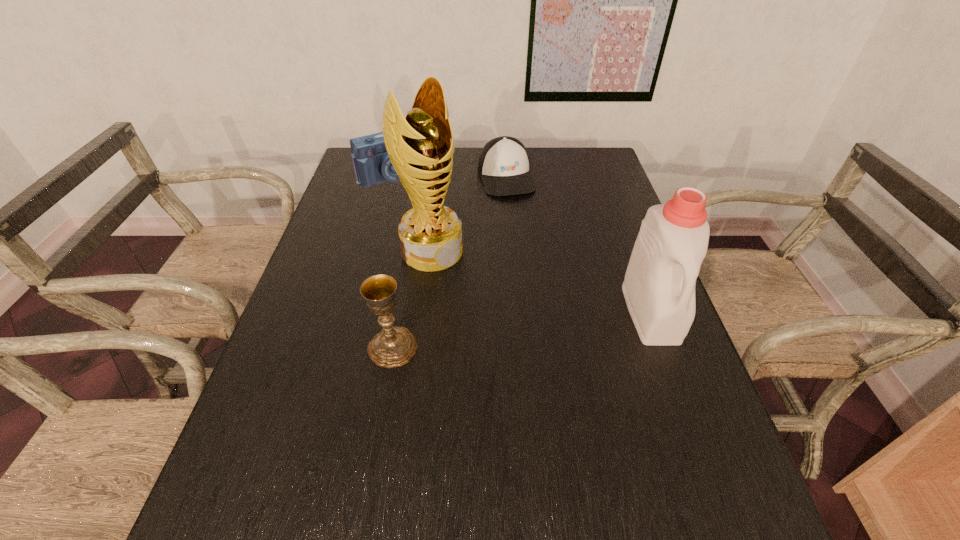
Find the location of a particular element. The width and height of the screenshot is (960, 540). vacant area situated on the front-facing side of the third farthest object is located at coordinates (477, 289).

Find the location of a particular element. vacant space situated 0.390m on the front-facing side of the third farthest object is located at coordinates (562, 360).

This screenshot has width=960, height=540. In order to click on free location located on the front-facing side of the third farthest object in this screenshot , I will do `click(544, 346)`.

The image size is (960, 540). I want to click on vacant area situated 0.090m on the front panel of the shortest object, so click(518, 216).

Identify the location of free point located 0.140m on the front panel of the shortest object. The image size is (960, 540). (522, 226).

The height and width of the screenshot is (540, 960). Identify the location of free location located 0.100m on the front panel of the shortest object. (519, 218).

Find the location of a particular element. vacant area situated 0.200m on the lens of the camera is located at coordinates (435, 220).

At what (x,y) coordinates should I click in order to perform the action: click on blank area located on the lens of the camera. Please return your answer as a coordinate pair (x, y). Looking at the image, I should click on (422, 205).

I want to click on free space located on the lens of the camera, so click(432, 217).

Where is `cap positioned at the far edge`? Image resolution: width=960 pixels, height=540 pixels. cap positioned at the far edge is located at coordinates (503, 166).